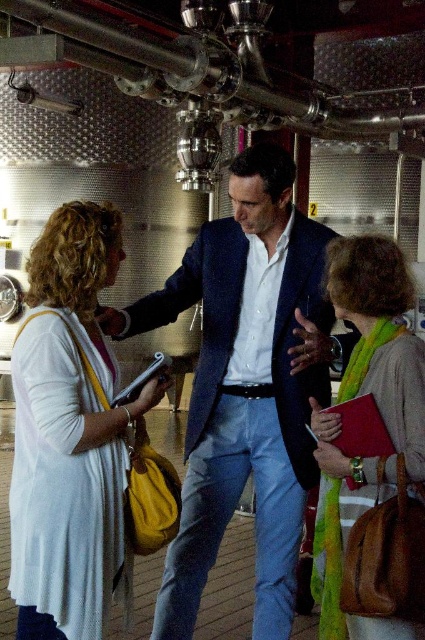
You are a tour guide leading a group through this industrial winery. You notice the navy blue suit at center and the matte red notebook at center. If you want to hand out a brochure to both people, which one can you reach first without moving from your current position?

The navy blue suit at center is closer to you than the matte red notebook at center, so you can reach them first without moving.

You are standing in the winery and want to take a photo of both the point at coordinates point (42, 582) and the point at coordinates point (325, 422). Which point should you focus on first to ensure both are in focus?

You should focus on point (42, 582) first because it is closer to the camera than point (325, 422). This ensures that the closer point is in focus, and the farther point will also be within the depth of field.